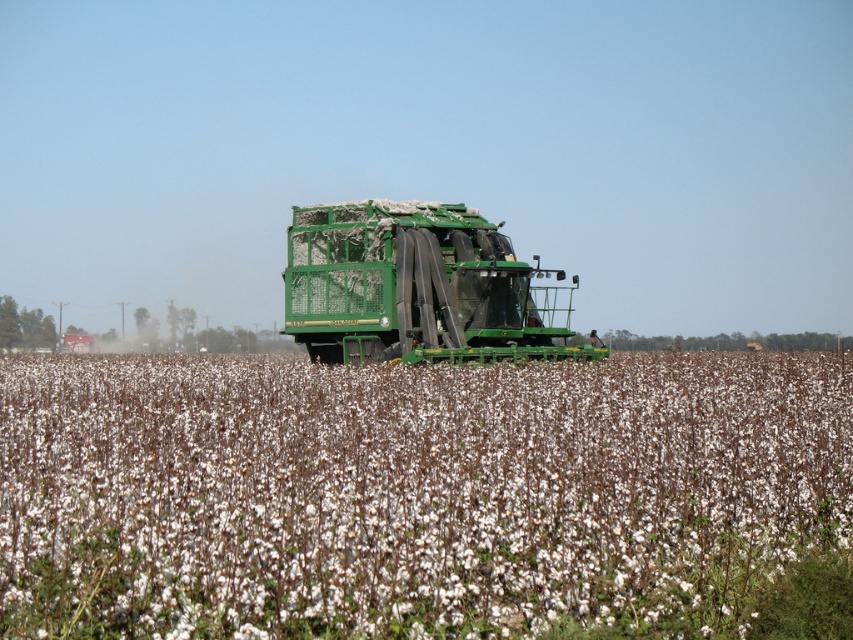
What do you see at coordinates (415, 493) in the screenshot? This screenshot has width=853, height=640. I see `white fluffy cotton at center` at bounding box center [415, 493].

From the picture: Which is above, white fluffy cotton at center or green matte trailer truck at center?

green matte trailer truck at center

Which is behind, point (257, 508) or point (589, 348)?

Point (589, 348)

Locate an element on the screen. white fluffy cotton at center is located at coordinates (415, 493).